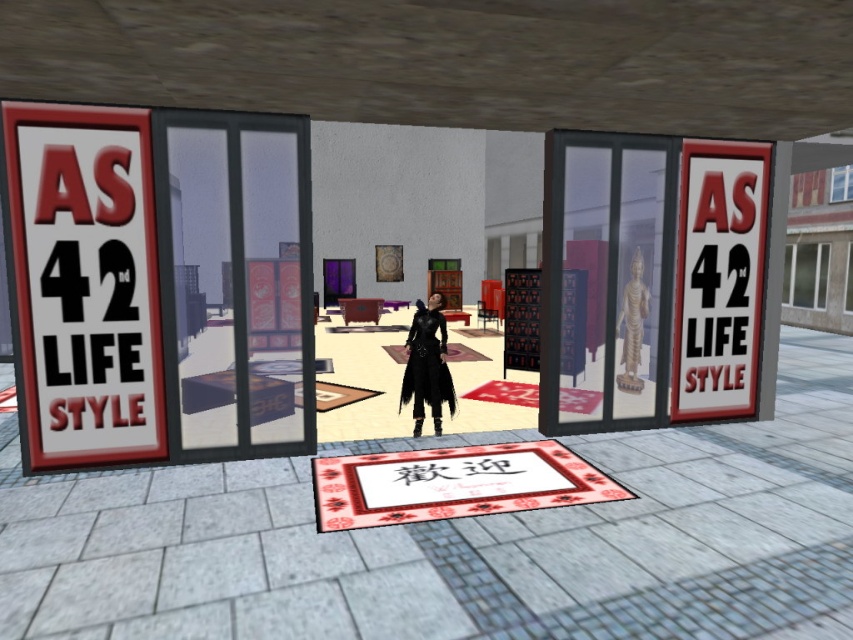
You are a delivery person standing outside the store and need to place a package on the transparent glass statue at center and the red plastic sign at right. Which object is closer to you so you can place the package there first?

The transparent glass statue at center is closer to the viewer than the red plastic sign at right, so you can place the package there first.

You are a delivery person holding a large package that is 1.2 meters in height. You arrive at the storefront and see the transparent glass door at center and the matte black coat at center. Which object would you need to avoid hitting with your package as you enter through the door?

The transparent glass door at center has a larger size compared to the matte black coat at center, so you should avoid hitting the transparent glass door at center with your package as it is bigger and more likely to obstruct your path.